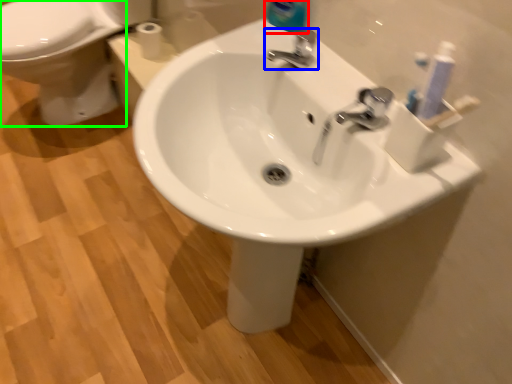
Question: Estimate the real-world distances between objects in this image. Which object is closer to cleaning product (highlighted by a red box), tap (highlighted by a blue box) or bidet (highlighted by a green box)?

Choices:
 (A) tap
 (B) bidet

Answer: (A)